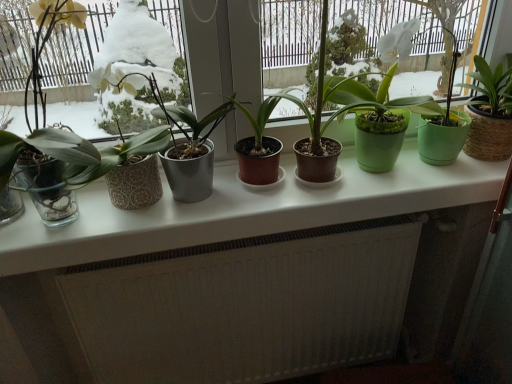
Find the location of a particular element. Image resolution: width=512 pixels, height=384 pixels. empty space that is to the right of metallic gray pot at center, which is the 4th houseplant in right-to-left order is located at coordinates (269, 203).